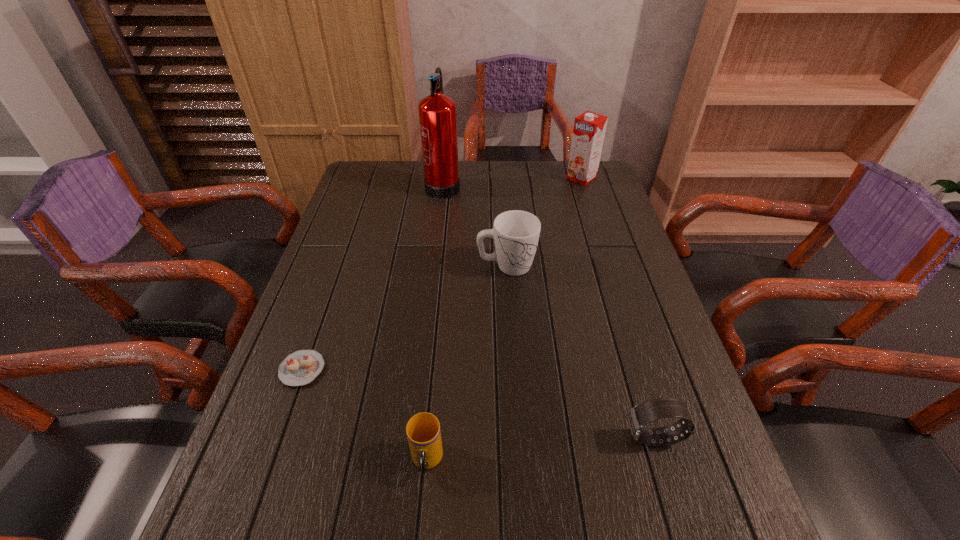
Where is `vacant space that is in between the fourth nearest object and the watch`? vacant space that is in between the fourth nearest object and the watch is located at coordinates (580, 352).

This screenshot has width=960, height=540. I want to click on free spot between the cup and the watch, so click(x=540, y=449).

I want to click on empty space between the fourth shortest object and the fifth shortest object, so click(544, 221).

At what (x,y) coordinates should I click in order to perform the action: click on free point between the cup and the watch. Please return your answer as a coordinate pair (x, y). Looking at the image, I should click on (540, 449).

You are a GUI agent. You are given a task and a screenshot of the screen. Output one action in this format:
    pyautogui.click(x=<x>, y=<y>)
    Task: Click on the free spot between the third tallest object and the carton
    This screenshot has height=540, width=960.
    Given the screenshot: What is the action you would take?
    pyautogui.click(x=544, y=221)

The image size is (960, 540). In order to click on unoccupied position between the carton and the watch in this screenshot , I will do `click(617, 308)`.

The image size is (960, 540). In order to click on free spot between the fourth farthest object and the second tallest object in this screenshot , I will do `click(442, 273)`.

Where is `object that ranks as the third closest to the cupcake`? object that ranks as the third closest to the cupcake is located at coordinates (437, 112).

Point out which object is positioned as the fifth nearest to the second tallest object. Please provide its 2D coordinates. Your answer should be formatted as a tuple, i.e. [(x, y)], where the tuple contains the x and y coordinates of a point satisfying the conditions above.

[(423, 431)]

I want to click on vacant space that satisfies the following two spatial constraints: 1. on the back side of the cupcake; 2. on the right side of the carton, so click(x=370, y=177).